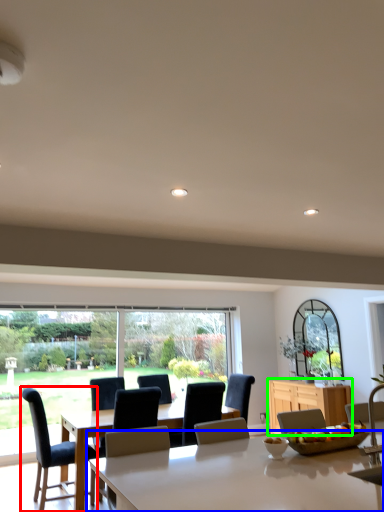
Question: Considering the real-world distances, which object is farthest from chair (highlighted by a red box)? table (highlighted by a blue box) or cabinetry (highlighted by a green box)?

Choices:
 (A) table
 (B) cabinetry

Answer: (A)